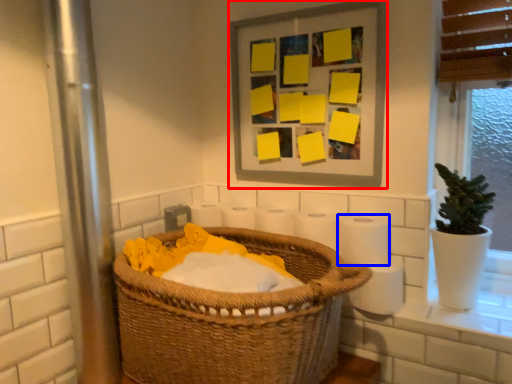
Question: Among these objects, which one is farthest to the camera, picture frame (highlighted by a red box) or toilet paper (highlighted by a blue box)?

Choices:
 (A) picture frame
 (B) toilet paper

Answer: (A)